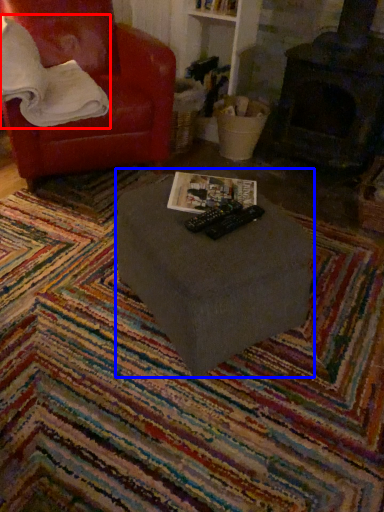
Question: Which object appears closest to the camera in this image, pillow (highlighted by a red box) or table (highlighted by a blue box)?

Choices:
 (A) pillow
 (B) table

Answer: (B)